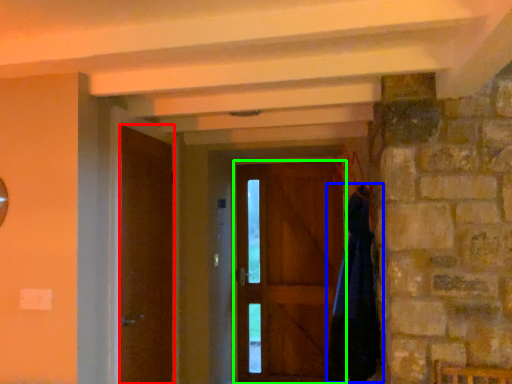
Question: Which object is positioned closest to door (highlighted by a red box)? Select from cloak (highlighted by a blue box) and door (highlighted by a green box).

Choices:
 (A) cloak
 (B) door

Answer: (A)